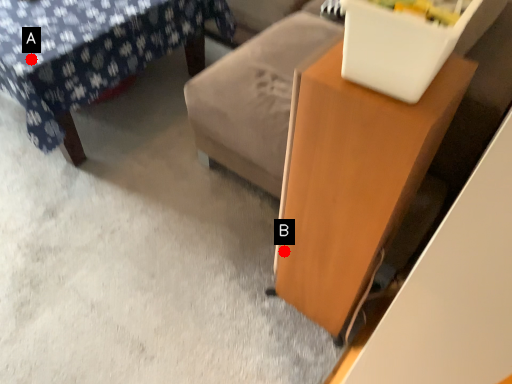
Question: Two points are circled on the image, labeled by A and B beside each circle. Which point appears closest to the camera in this image?

Choices:
 (A) A is closer
 (B) B is closer

Answer: (B)